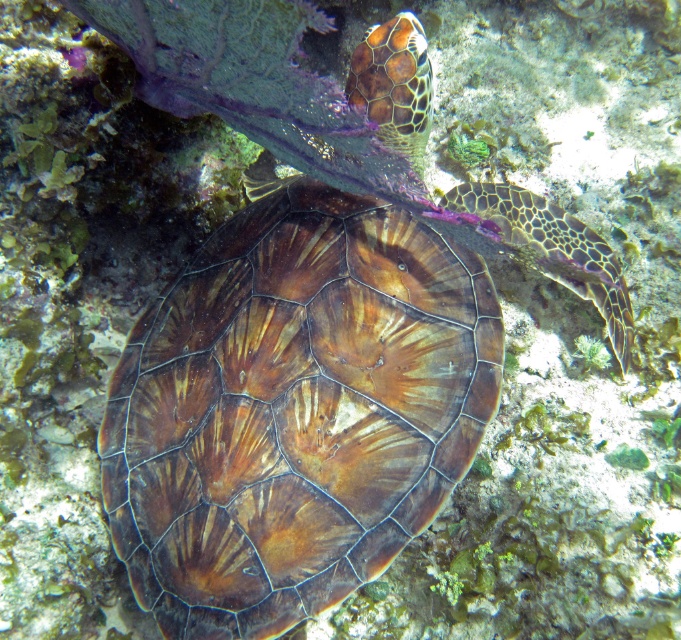
Question: Observing the image, what is the correct spatial positioning of leathery brown tortoise at center in reference to brown textured shell at upper center?

Choices:
 (A) above
 (B) below

Answer: (B)

Question: Which of the following is the farthest from the observer?

Choices:
 (A) leathery brown tortoise at center
 (B) brown leathery shell at center

Answer: (A)

Question: Which point appears farthest from the camera in this image?

Choices:
 (A) (622, 305)
 (B) (375, 64)
 (C) (127, 477)

Answer: (A)

Question: From the image, what is the correct spatial relationship of brown leathery shell at center in relation to leathery brown tortoise at center?

Choices:
 (A) below
 (B) above

Answer: (A)

Question: Considering the real-world distances, which object is farthest from the brown leathery shell at center?

Choices:
 (A) brown textured shell at upper center
 (B) leathery brown tortoise at center

Answer: (B)

Question: Is brown leathery shell at center below brown textured shell at upper center?

Choices:
 (A) yes
 (B) no

Answer: (A)